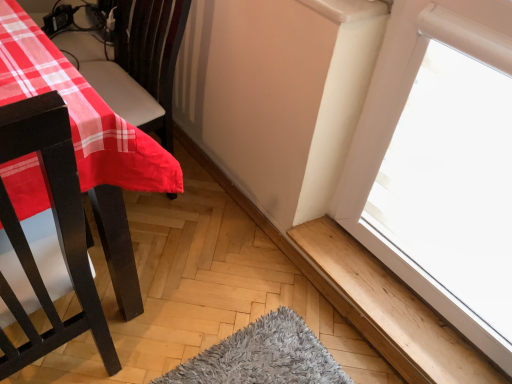
You are a GUI agent. You are given a task and a screenshot of the screen. Output one action in this format:
    pyautogui.click(x=<x>, y=<y>)
    Task: Click on the vacant space situated above wooden at lower right (from a real-world perspective)
    The height and width of the screenshot is (384, 512).
    Given the screenshot: What is the action you would take?
    pyautogui.click(x=409, y=305)